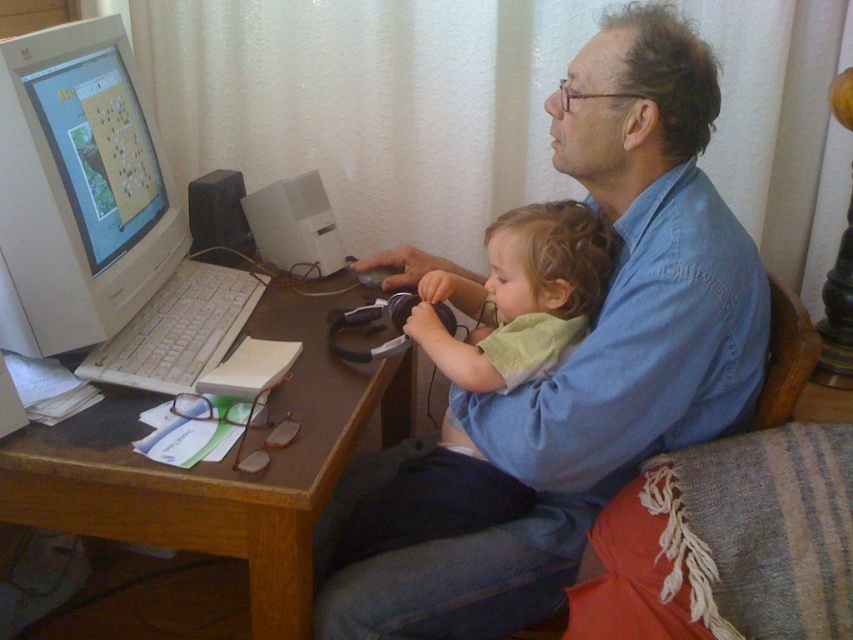
You are standing in front of the desk and want to place a new object exactly where the white glossy computer monitor at left is currently located. Where should you place it?

You should place the new object at the point coordinates of (78, 189), which is where the white glossy computer monitor at left is located.

You are standing in front of the desk in the scene. Where is the blue cotton shirt at upper right located in terms of its 2D coordinates?

The blue cotton shirt at upper right is located at the 2D coordinates of point (x=585, y=356).

You are standing in front of the desk and want to reach the point at coordinates point (625, 392). Can you safely extend your hand to touch it without moving your body?

The distance between you and point (625, 392) is 1.01 meters. Since the average human arm length is about 0.7 meters, you cannot reach it without moving your body.